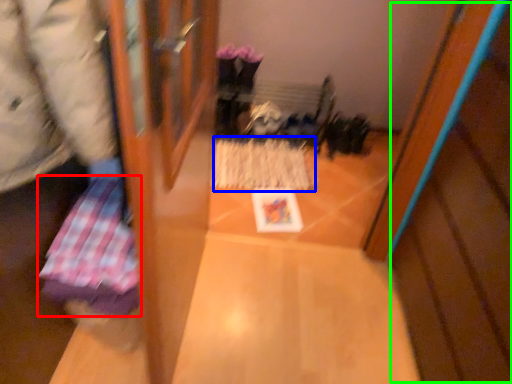
Question: Which object is the closest to the wrapping paper (highlighted by a red box)? Choose among these: wrapping paper (highlighted by a blue box) or wood (highlighted by a green box).

Choices:
 (A) wrapping paper
 (B) wood

Answer: (B)